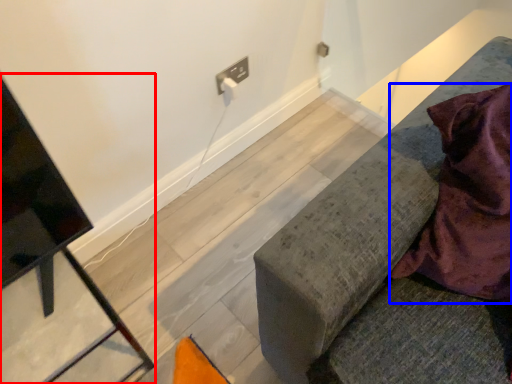
Question: Among these objects, which one is nearest to the camera, furniture (highlighted by a red box) or blanket (highlighted by a blue box)?

Choices:
 (A) furniture
 (B) blanket

Answer: (B)